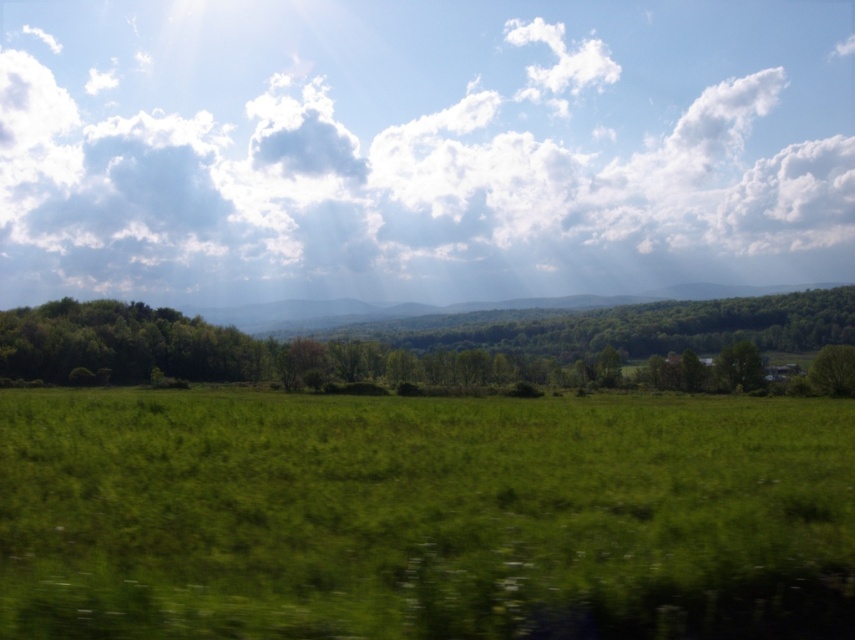
Does green grassy field at center have a lesser width compared to green leafy tree at center?

No.

Measure the distance between point (167, 396) and camera.

A distance of 67.87 meters exists between point (167, 396) and camera.

I want to click on green grassy field at center, so click(x=423, y=515).

Can you confirm if white fluffy cloud at upper center is thinner than green grassy field at center?

No, white fluffy cloud at upper center is not thinner than green grassy field at center.

Who is more distant from viewer, (x=705, y=61) or (x=568, y=598)?

Positioned behind is point (x=705, y=61).

Between point (680, 116) and point (643, 576), which one is positioned behind?

Point (680, 116)

I want to click on white fluffy cloud at upper center, so click(x=422, y=147).

Is green leafy trees at left to the left of green leafy tree at right from the viewer's perspective?

Correct, you'll find green leafy trees at left to the left of green leafy tree at right.

Where is `green leafy trees at left`? The height and width of the screenshot is (640, 855). green leafy trees at left is located at coordinates (588, 339).